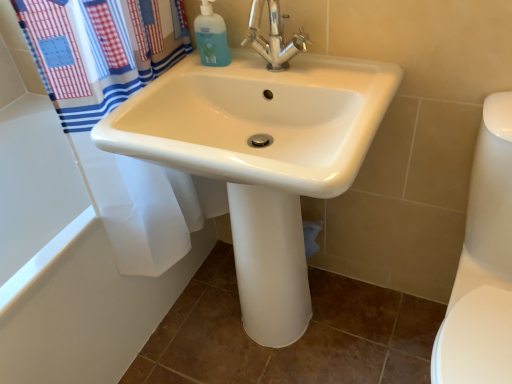
Find the location of a particular element. This screenshot has height=384, width=512. free space to the left of translucent plastic bottle at upper center is located at coordinates [178, 74].